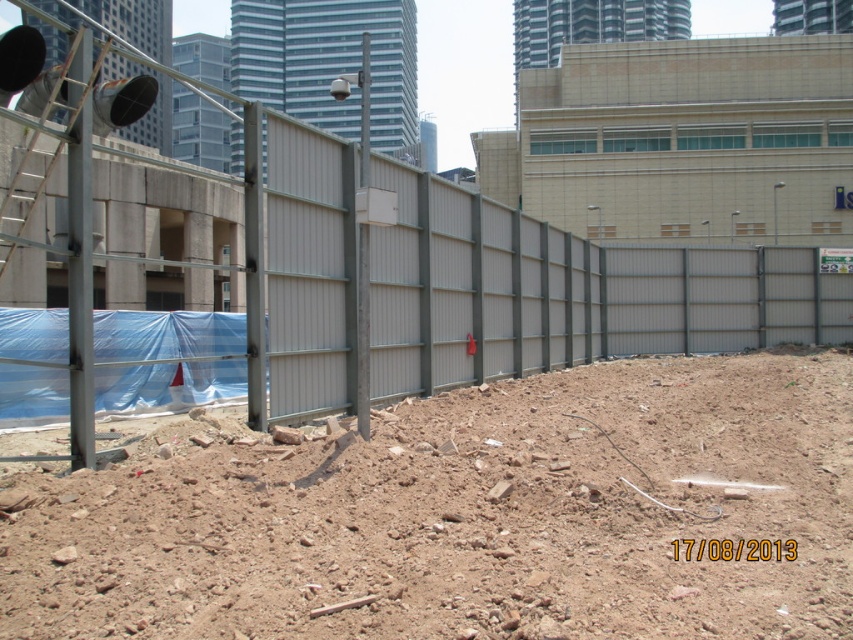
Question: Which point is closer to the camera?

Choices:
 (A) (602, 348)
 (B) (793, 365)

Answer: (B)

Question: Does brown dirt field at center come in front of metallic gray fence at center?

Choices:
 (A) yes
 (B) no

Answer: (A)

Question: Which object appears farthest from the camera in this image?

Choices:
 (A) metallic gray fence at center
 (B) brown dirt field at center

Answer: (A)

Question: Observing the image, what is the correct spatial positioning of brown dirt field at center in reference to metallic gray fence at center?

Choices:
 (A) below
 (B) above

Answer: (A)

Question: Where is brown dirt field at center located in relation to metallic gray fence at center in the image?

Choices:
 (A) above
 (B) below

Answer: (B)